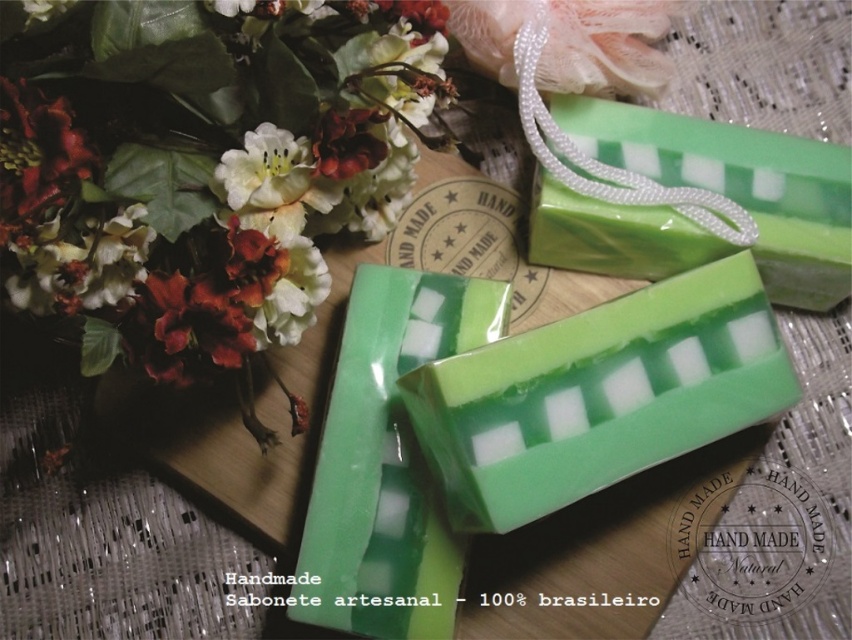
Question: Which object appears closest to the camera in this image?

Choices:
 (A) green translucent soap at center
 (B) green matte soap at upper right

Answer: (A)

Question: Which of these objects is positioned farthest from the green translucent soap at center?

Choices:
 (A) matte floral bouquet at upper left
 (B) green matte soap at upper right

Answer: (A)

Question: Is green translucent soap at center below green matte soap at upper right?

Choices:
 (A) yes
 (B) no

Answer: (A)

Question: Does matte floral bouquet at upper left have a lesser width compared to green matte soap at upper right?

Choices:
 (A) no
 (B) yes

Answer: (A)

Question: Is the position of green translucent soap at center less distant than that of green matte soap at upper right?

Choices:
 (A) no
 (B) yes

Answer: (B)

Question: Which of these objects is positioned closest to the green matte soap at upper right?

Choices:
 (A) green translucent soap at center
 (B) matte floral bouquet at upper left

Answer: (A)